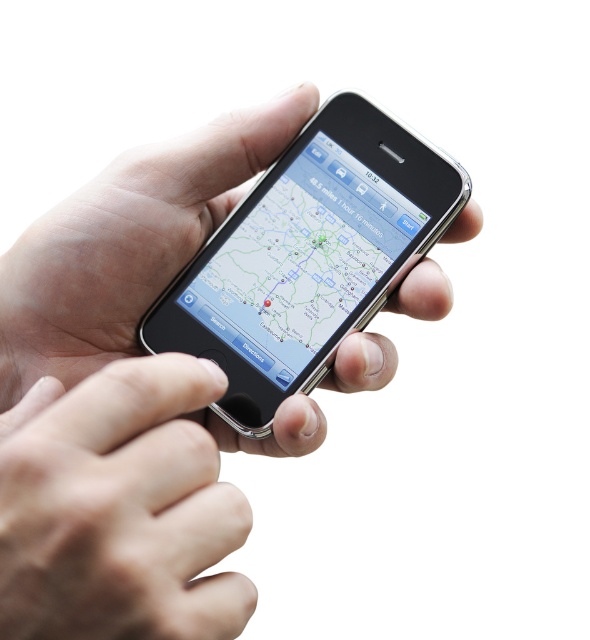
Question: Which point is farther to the camera?

Choices:
 (A) smooth skin hand at center
 (B) sleek silver phone at center

Answer: (B)

Question: Is smooth skin hand at center below sleek silver phone at center?

Choices:
 (A) yes
 (B) no

Answer: (A)

Question: Does smooth skin hand at center have a smaller size compared to sleek silver phone at center?

Choices:
 (A) no
 (B) yes

Answer: (B)

Question: Estimate the real-world distances between objects in this image. Which object is closer to the silver metallic phone at center?

Choices:
 (A) smooth skin hand at center
 (B) sleek silver phone at center

Answer: (A)

Question: Where is silver metallic phone at center located in relation to sleek silver phone at center in the image?

Choices:
 (A) below
 (B) above

Answer: (A)

Question: Which point is farther to the camera?

Choices:
 (A) silver metallic phone at center
 (B) smooth skin hand at center
 (C) sleek silver phone at center

Answer: (C)